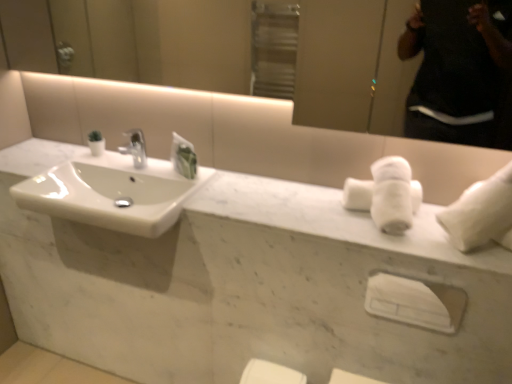
Where is `vacant space situated on the left part of white fluffy bath towel at upper right, marked as the 2th bath towel in a right-to-left arrangement`? This screenshot has height=384, width=512. vacant space situated on the left part of white fluffy bath towel at upper right, marked as the 2th bath towel in a right-to-left arrangement is located at coordinates (298, 207).